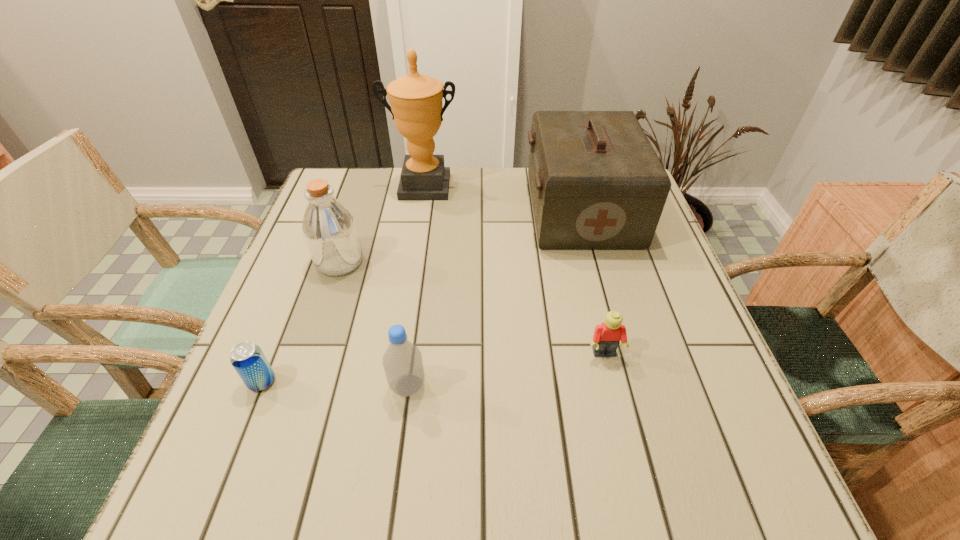
The image size is (960, 540). Find the location of `vacant region located on the right of the farther bottle`. vacant region located on the right of the farther bottle is located at coordinates (506, 261).

What are the coordinates of `vacant space located 0.100m on the right of the shorter bottle` in the screenshot? It's located at (480, 386).

At what (x,y) coordinates should I click in order to perform the action: click on vacant space situated 0.130m on the face of the fourth farthest object. Please return your answer as a coordinate pair (x, y). Looking at the image, I should click on (621, 426).

I want to click on vacant space located on the right of the shortest object, so click(367, 381).

Find the location of `award present at the far edge`. award present at the far edge is located at coordinates (416, 99).

You are a GUI agent. You are given a task and a screenshot of the screen. Output one action in this format:
    pyautogui.click(x=<x>, y=<y>)
    Task: Click on the first-aid kit located in the far edge section of the desktop
    
    Given the screenshot: What is the action you would take?
    pyautogui.click(x=596, y=182)

The width and height of the screenshot is (960, 540). I want to click on bottle situated at the left edge, so pyautogui.click(x=329, y=229).

You are a GUI agent. You are given a task and a screenshot of the screen. Output one action in this format:
    pyautogui.click(x=<x>, y=<y>)
    Task: Click on the beer can that is at the left edge
    The width and height of the screenshot is (960, 540).
    Given the screenshot: What is the action you would take?
    (248, 360)

Find the location of `object present at the right edge`. object present at the right edge is located at coordinates (596, 182).

Locate an element on the screen. This screenshot has height=540, width=960. object at the far right corner is located at coordinates (596, 182).